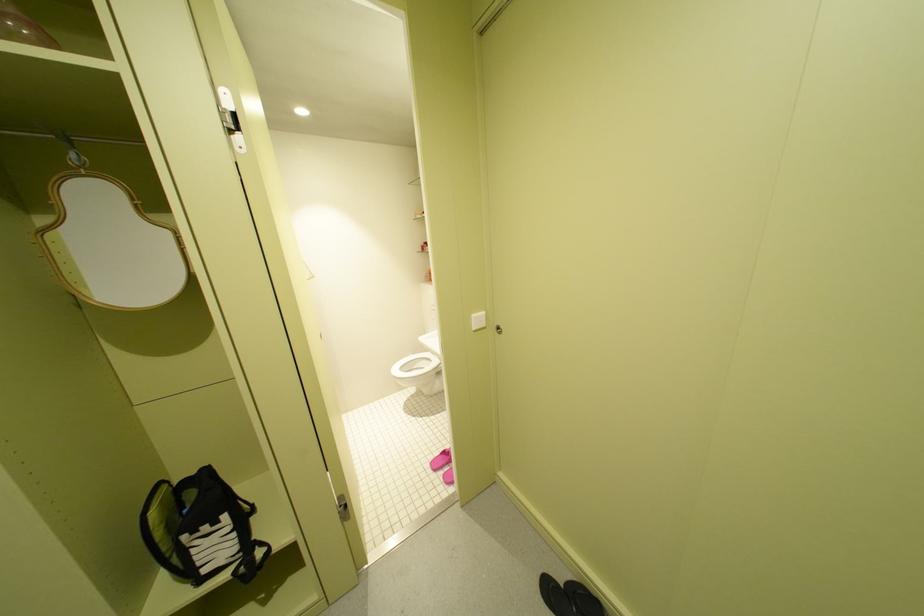
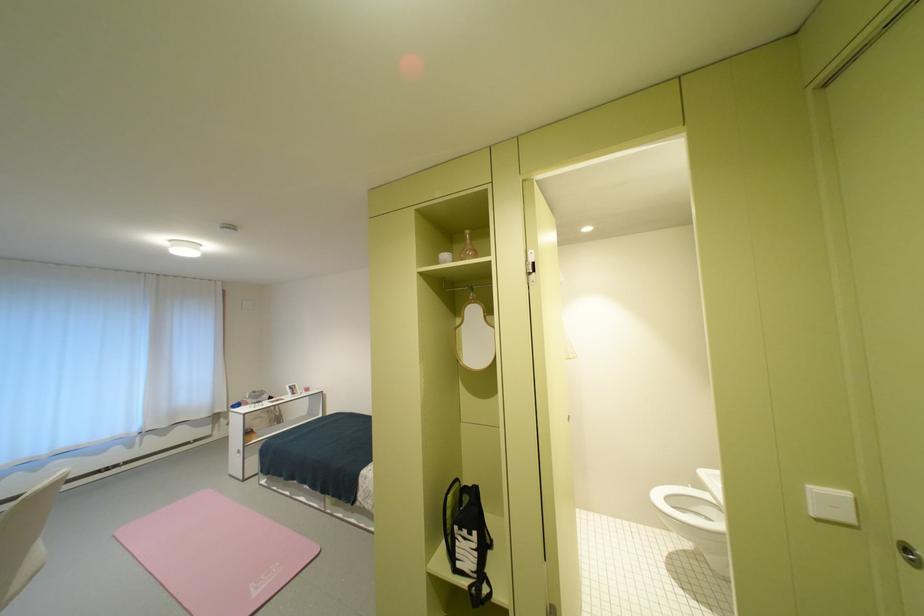
Find the pixel in the second image that matches point 201,552 in the first image.

(467, 543)